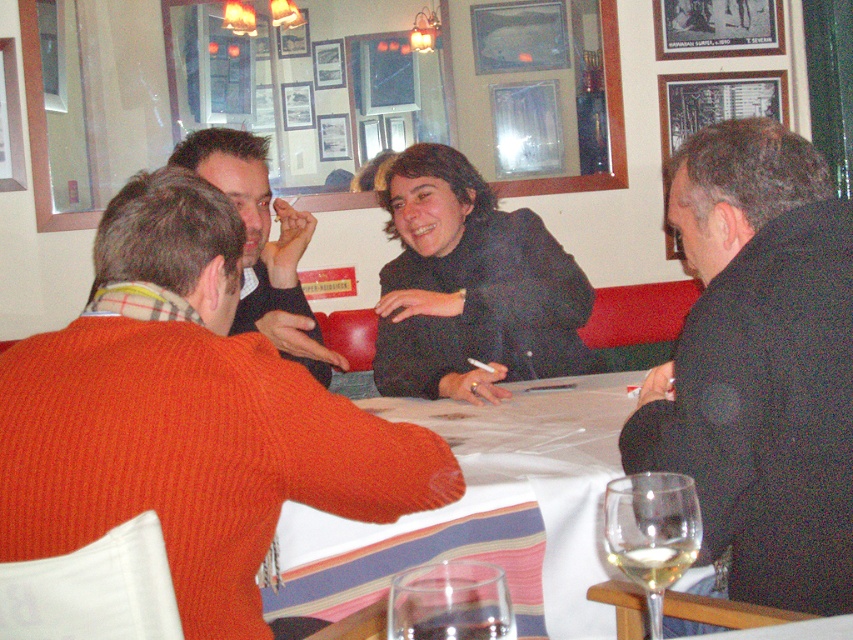
Question: Does black matte jacket at upper center appear over orange knit sweater at left?

Choices:
 (A) no
 (B) yes

Answer: (A)

Question: Does white cloth at center have a larger size compared to orange knit sweater at left?

Choices:
 (A) yes
 (B) no

Answer: (A)

Question: Which is farther from the clear glass wine glass at lower right?

Choices:
 (A) white cloth at center
 (B) black matte jacket at center
 (C) clear glass at lower center
 (D) black matte jacket at upper center

Answer: (B)

Question: Based on their relative distances, which object is farther from the black wool coat at right?

Choices:
 (A) black matte jacket at upper center
 (B) white cloth at center
 (C) clear glass wine at lower right

Answer: (A)

Question: Can you confirm if black matte jacket at center is thinner than clear glass wine glass at lower right?

Choices:
 (A) no
 (B) yes

Answer: (A)

Question: Which point is closer to the camera?

Choices:
 (A) clear glass at lower center
 (B) black matte jacket at center
 (C) black matte jacket at upper center
 (D) black wool coat at right

Answer: (A)